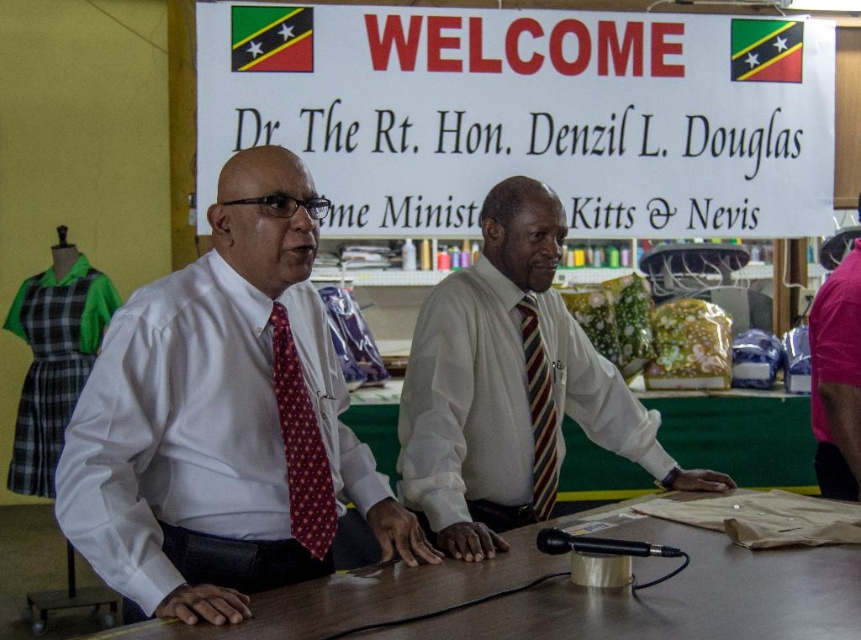
Does point (240, 38) come in front of point (536, 467)?

No.

Is red fabric flag at upper center behind striped fabric tie at center?

Yes, it is.

Which is in front, point (296, 20) or point (555, 467)?

Point (555, 467) is in front.

Identify the location of red fabric flag at upper center. (271, 38).

Who is lower down, wooden table at center or dark skin hand at table center?

wooden table at center

Is wooden table at center to the right of dark skin hand at table center from the viewer's perspective?

Correct, you'll find wooden table at center to the right of dark skin hand at table center.

Is point (661, 532) farther from viewer compared to point (449, 531)?

That is True.

At what (x,y) coordinates should I click in order to perform the action: click on wooden table at center. Please return your answer as a coordinate pair (x, y). Image resolution: width=861 pixels, height=640 pixels. Looking at the image, I should click on (567, 596).

Which of these two, matte white shirt at left or striped fabric tie at center, stands taller?

matte white shirt at left is taller.

Between point (345, 458) and point (536, 316), which one is positioned in front?

Point (345, 458) is more forward.

Does point (274, 209) come in front of point (530, 364)?

That is True.

Image resolution: width=861 pixels, height=640 pixels. I want to click on matte white shirt at left, so coord(218,410).